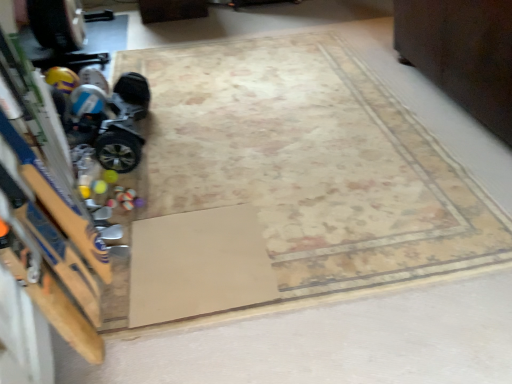
This screenshot has width=512, height=384. What are the coordinates of `vacant space to the right of brown cardboard at center` in the screenshot? It's located at (313, 238).